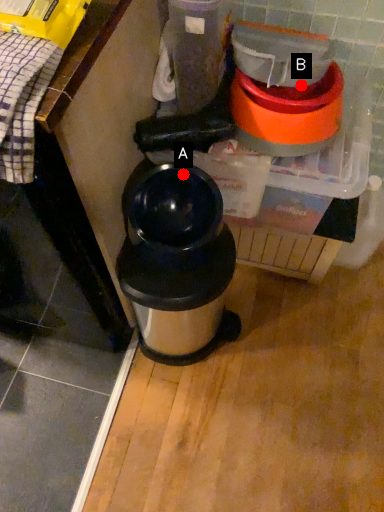
Question: Two points are circled on the image, labeled by A and B beside each circle. Which point is further to the camera?

Choices:
 (A) A is further
 (B) B is further

Answer: (A)